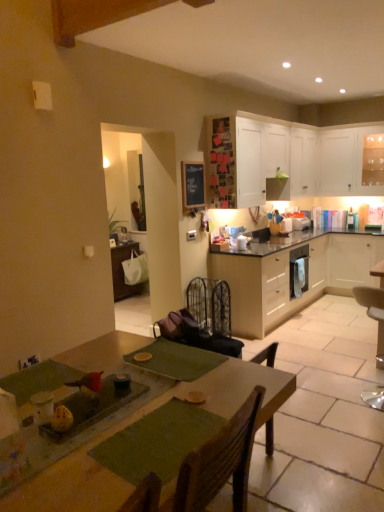
Find the location of a particular element. The width and height of the screenshot is (384, 512). vacant space in metallic silver chair at lower right (from a real-world perspective) is located at coordinates (360, 398).